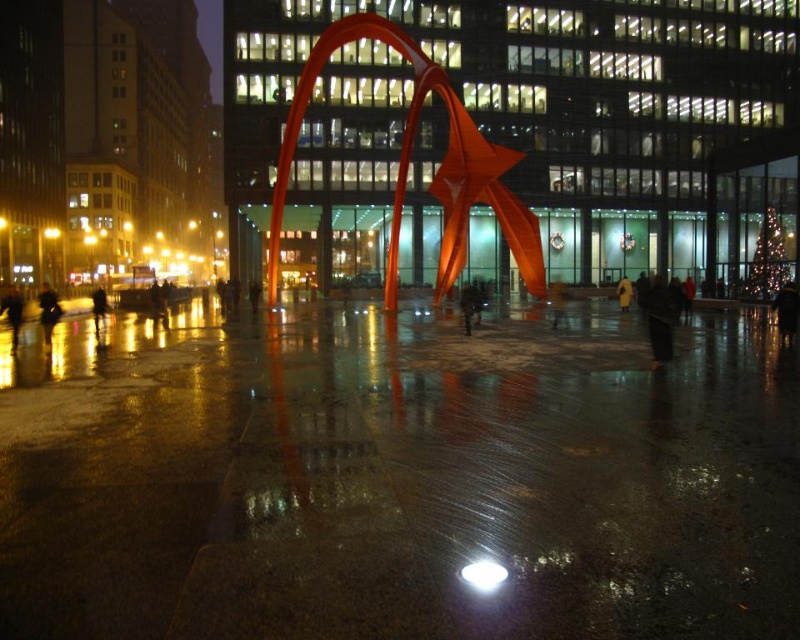
Locate an element on the screen. The width and height of the screenshot is (800, 640). shiny orange sculpture at center is located at coordinates (409, 161).

Who is more distant from viewer, (454, 212) or (93, 298)?

Positioned behind is point (454, 212).

I want to click on shiny orange sculpture at center, so click(x=409, y=161).